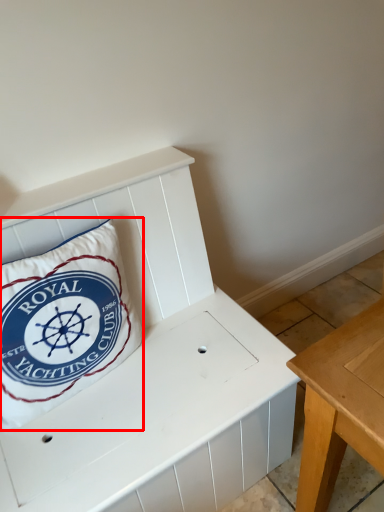
Question: From the image's perspective, where is pillow (annotated by the red box) located relative to furniture?

Choices:
 (A) below
 (B) above

Answer: (B)